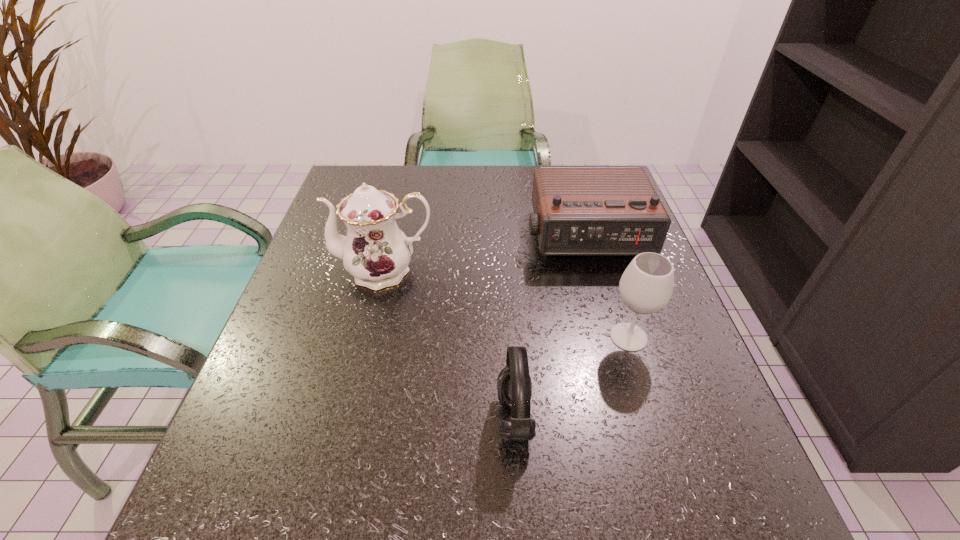
This screenshot has width=960, height=540. Find the location of `free space located on the earcups of the third object from right to left`. free space located on the earcups of the third object from right to left is located at coordinates (345, 418).

Where is `free space located on the earcups of the third object from right to left`? The image size is (960, 540). free space located on the earcups of the third object from right to left is located at coordinates (363, 418).

In order to click on free space located on the earcups of the third object from right to left in this screenshot , I will do `click(351, 418)`.

Locate an element on the screen. object that is at the far edge is located at coordinates (578, 211).

I want to click on object located in the left edge section of the desktop, so click(x=375, y=252).

Locate an element on the screen. This screenshot has width=960, height=540. wineglass at the right edge is located at coordinates (646, 286).

Where is `radio receiver positioned at the right edge`? radio receiver positioned at the right edge is located at coordinates (578, 211).

Where is `object that is positioned at the far right corner`? object that is positioned at the far right corner is located at coordinates (578, 211).

The width and height of the screenshot is (960, 540). Identify the location of vacant space at the far edge of the desktop. (501, 197).

Identify the location of free space at the left edge. (343, 305).